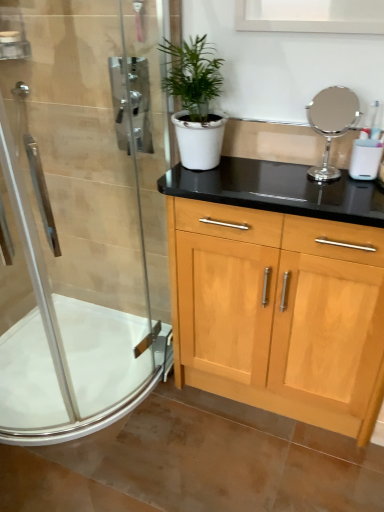
Question: From a real-world perspective, is polished chrome mirror at upper right above or below clear glass shower door at left?

Choices:
 (A) above
 (B) below

Answer: (A)

Question: In terms of width, does polished chrome mirror at upper right look wider or thinner when compared to clear glass shower door at left?

Choices:
 (A) thin
 (B) wide

Answer: (A)

Question: Considering the real-world distances, which object is closest to the white matte pot at center?

Choices:
 (A) polished chrome mirror at upper right
 (B) clear glass shower door at left
 (C) white glossy bath at lower left

Answer: (A)

Question: Considering the real-world distances, which object is farthest from the white matte pot at center?

Choices:
 (A) polished chrome mirror at upper right
 (B) white glossy bath at lower left
 (C) clear glass shower door at left

Answer: (B)